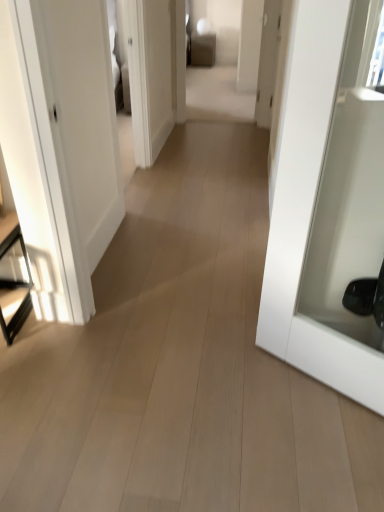
The height and width of the screenshot is (512, 384). I want to click on blank space to the left of white glossy door at right, so click(227, 388).